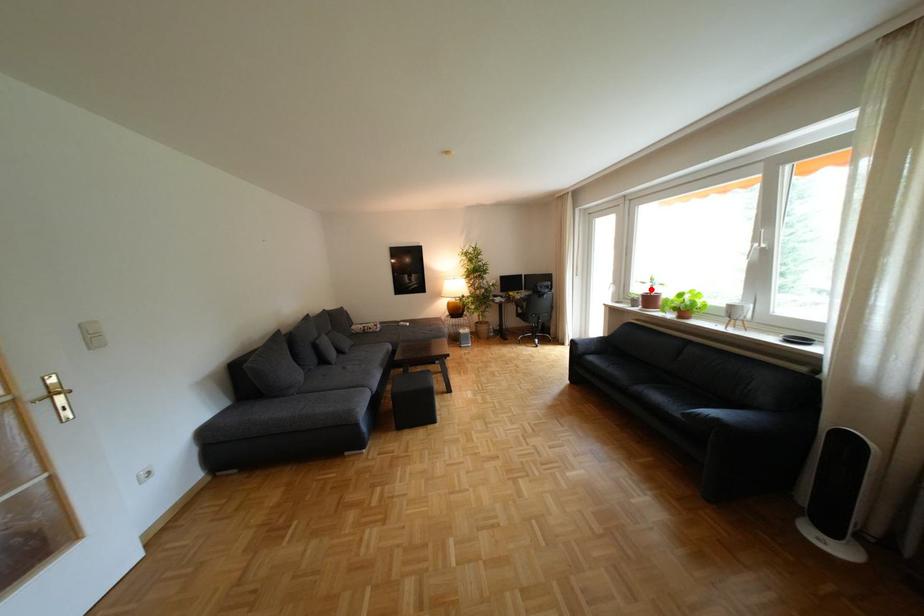
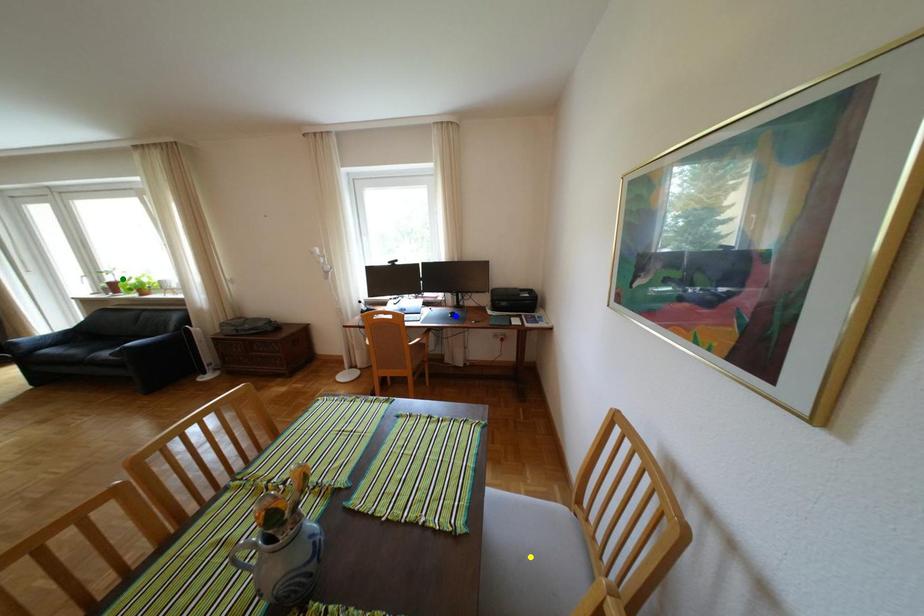
Question: I am providing you with two images of the same scene from different viewpoints. A red point is marked on the first image. You are given multiple points on the second image. In image 2, which mark is for the same physical point as the one in image 1?

Choices:
 (A) yellow point
 (B) blue point
 (C) green point

Answer: (C)